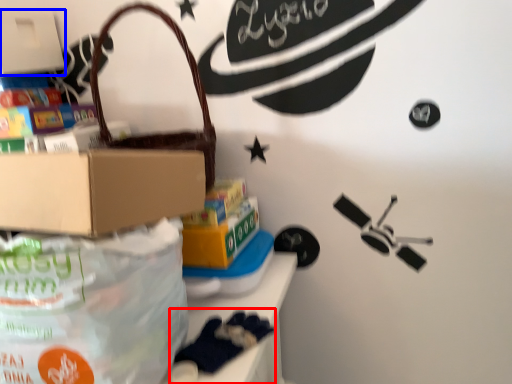
Question: Which object is closer to the camera taking this photo, toy (highlighted by a red box) or box (highlighted by a blue box)?

Choices:
 (A) toy
 (B) box

Answer: (A)